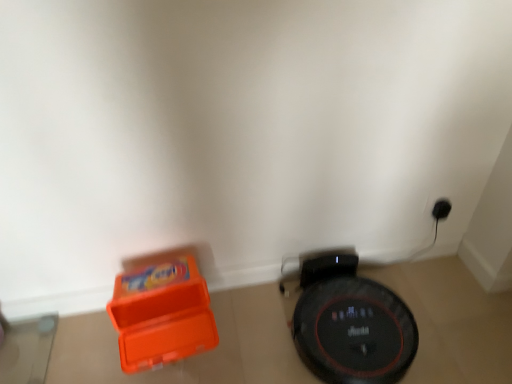
The height and width of the screenshot is (384, 512). I want to click on free region on the left part of black glossy robot vacuum cleaner at lower right, so click(x=259, y=333).